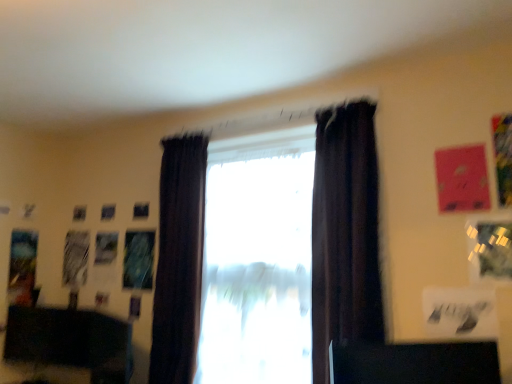
Question: Considering the positions of dark velvet curtain at center, arranged as the 1th curtain when viewed from the right, and dark fabric curtain at center, the 1th curtain when ordered from left to right, in the image, is dark velvet curtain at center, arranged as the 1th curtain when viewed from the right, taller or shorter than dark fabric curtain at center, the 1th curtain when ordered from left to right,?

Choices:
 (A) tall
 (B) short

Answer: (B)

Question: From a real-world perspective, relative to dark fabric curtain at center, marked as the 2th curtain in a front-to-back arrangement, is dark velvet curtain at center, the first curtain positioned from the front, vertically above or below?

Choices:
 (A) below
 (B) above

Answer: (B)

Question: Which object is the farthest from the black glossy desk at lower right, marked as the 1th furniture in a right-to-left arrangement?

Choices:
 (A) dark velvet curtain at center, the first curtain positioned from the front
 (B) dark fabric curtain at center, the 2th curtain from the right
 (C) transparent glass window at center, which ranks as the 2th window in left-to-right order
 (D) black matte desk at lower left, which is counted as the 1th furniture, starting from the left
 (E) satin dark curtains at center, the 2th window from the right

Answer: (D)

Question: Which of these objects is positioned farthest from the black glossy desk at lower right, marked as the 1th furniture in a right-to-left arrangement?

Choices:
 (A) transparent glass window at center, which ranks as the 2th window in left-to-right order
 (B) dark velvet curtain at center, the first curtain positioned from the front
 (C) satin dark curtains at center, the 2th window from the right
 (D) black matte desk at lower left, the second furniture when ordered from right to left
 (E) dark fabric curtain at center, the 1th curtain when ordered from left to right

Answer: (D)